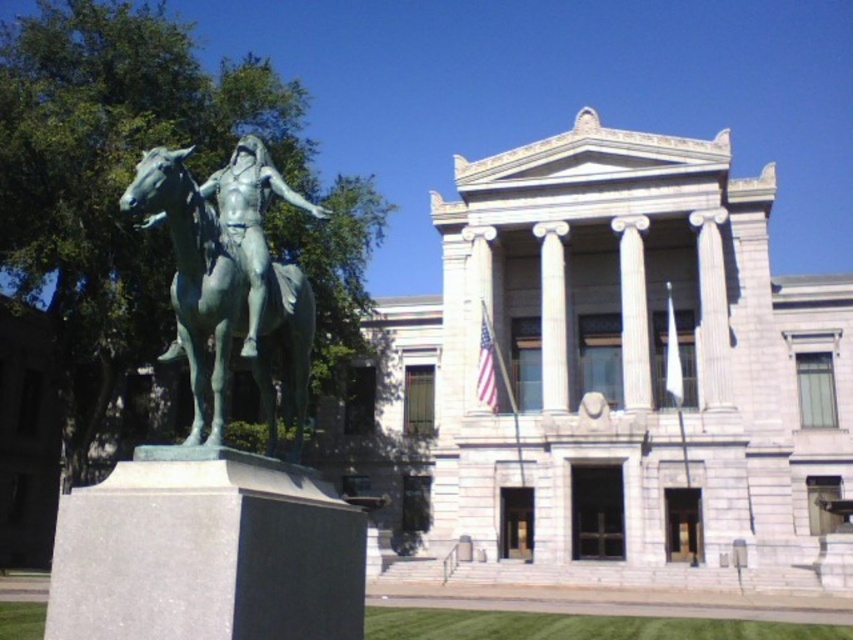
Which of these two, green grass at lower center or white marble column at center, stands shorter?

green grass at lower center

Is green grass at lower center below white marble column at center?

Indeed, green grass at lower center is positioned under white marble column at center.

What do you see at coordinates (576, 627) in the screenshot?
I see `green grass at lower center` at bounding box center [576, 627].

Where is `green grass at lower center`? Image resolution: width=853 pixels, height=640 pixels. green grass at lower center is located at coordinates (576, 627).

Between point (144, 221) and point (799, 636), which one is positioned behind?

Point (799, 636)

Who is lower down, green patina bronze statue at left or green grass at lower center?

green grass at lower center

Which is in front, point (219, 344) or point (624, 621)?

Positioned in front is point (219, 344).

Locate an element on the screen. The image size is (853, 640). green patina bronze statue at left is located at coordinates (229, 276).

Can you confirm if green patina bronze statue at left is taller than white marble column at center?

Yes, green patina bronze statue at left is taller than white marble column at center.

Who is positioned more to the right, green patina bronze statue at left or white marble column at center?

Positioned to the right is white marble column at center.

Where is `green patina bronze statue at left`? The image size is (853, 640). green patina bronze statue at left is located at coordinates (229, 276).